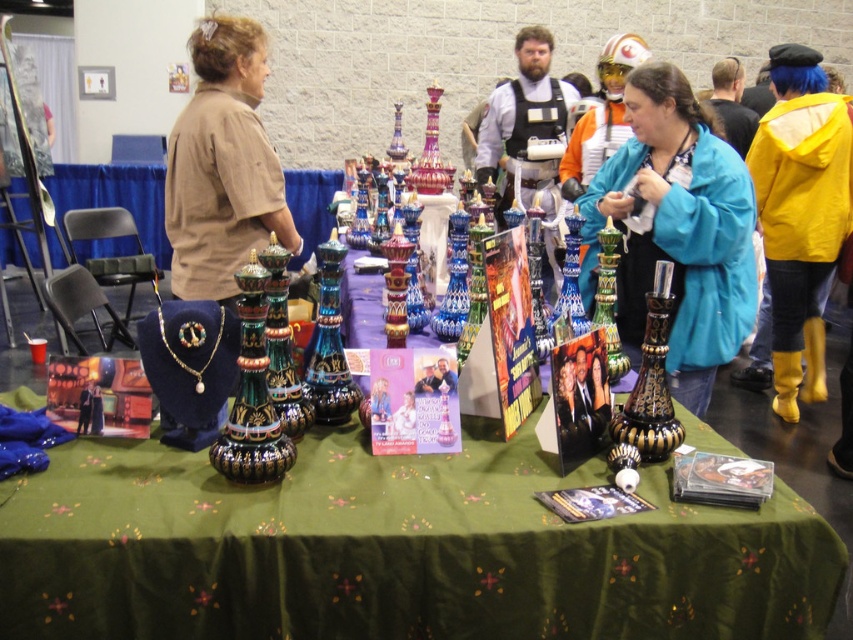
Can you confirm if multicolored glass vase at center is taller than teal matte jacket at center?

No.

Locate an element on the screen. This screenshot has width=853, height=640. multicolored glass vase at center is located at coordinates (393, 548).

Locate an element on the screen. This screenshot has height=640, width=853. multicolored glass vase at center is located at coordinates (393, 548).

Can you confirm if teal matte jacket at center is thinner than shiny black glass vase at center?

No.

Locate an element on the screen. The width and height of the screenshot is (853, 640). teal matte jacket at center is located at coordinates (677, 228).

Does multicolored glass vase at center have a smaller size compared to shiny black glass vase at center?

Actually, multicolored glass vase at center might be larger than shiny black glass vase at center.

Which is behind, point (3, 508) or point (659, 305)?

Point (659, 305)

The height and width of the screenshot is (640, 853). I want to click on multicolored glass vase at center, so click(393, 548).